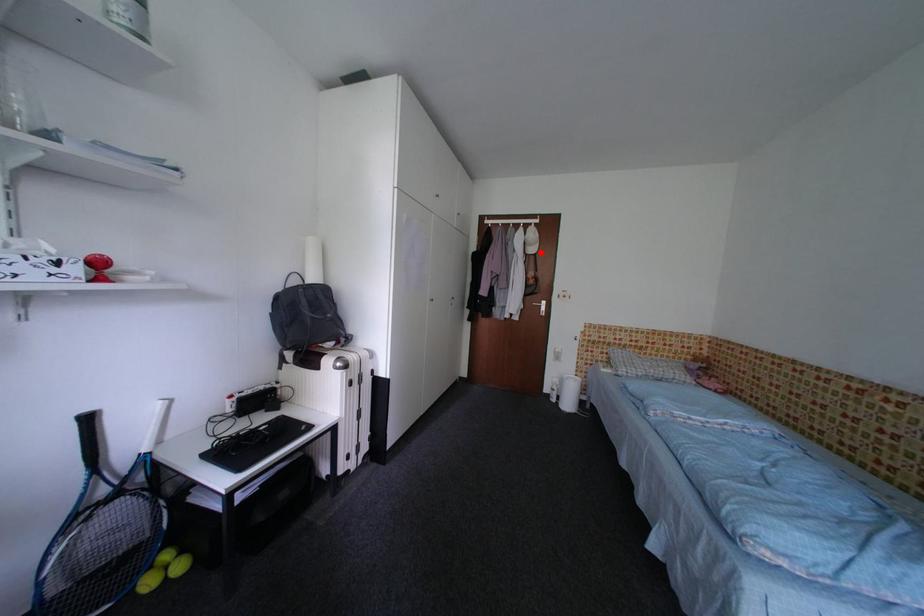
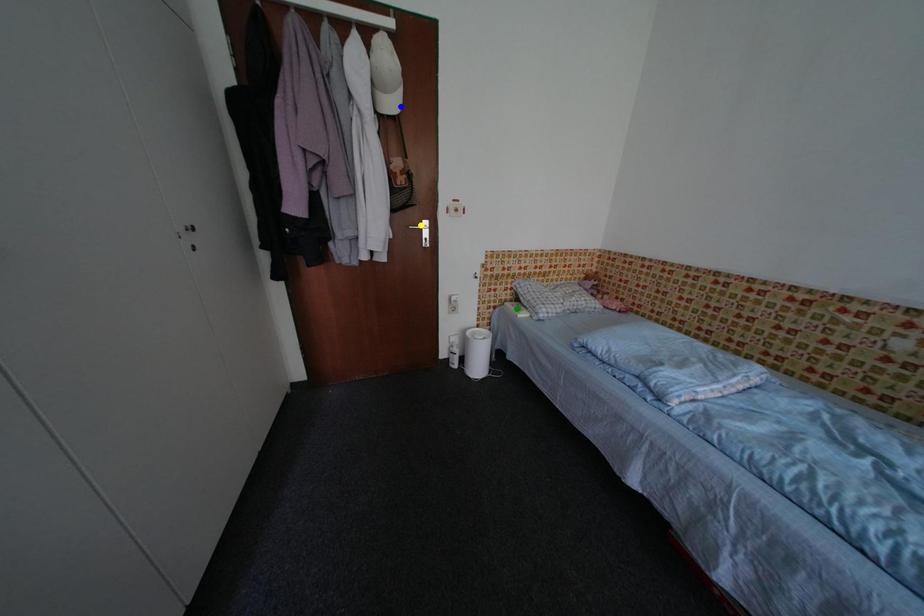
Question: I am providing you with two images of the same scene from different viewpoints. A red point is marked on the first image. You are given multiple points on the second image. Which point in image 2 represents the same 3d spot as the red point in image 1?

Choices:
 (A) blue point
 (B) yellow point
 (C) green point

Answer: (A)